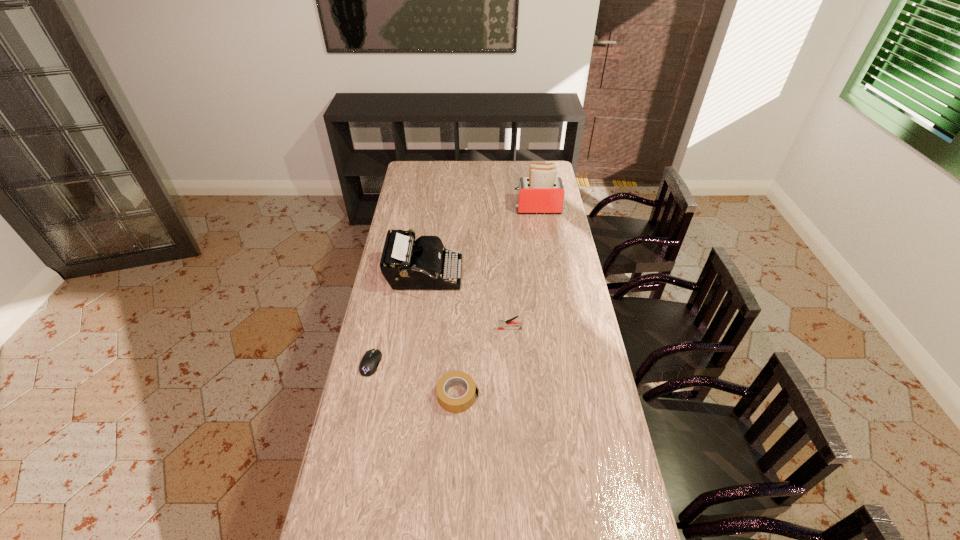
Locate an element on the screen. Image resolution: width=960 pixels, height=540 pixels. the rightmost object is located at coordinates (542, 192).

What are the coordinates of `the tallest object` in the screenshot? It's located at (542, 192).

Identify the location of the fourth nearest object. (407, 264).

In order to click on typewriter in this screenshot , I will do `click(407, 264)`.

Where is `the third tallest object`? The width and height of the screenshot is (960, 540). the third tallest object is located at coordinates (501, 326).

The image size is (960, 540). What are the coordinates of `the second object from right to left` in the screenshot? It's located at (501, 326).

Identify the location of duct tape. (456, 378).

You are a GUI agent. You are given a task and a screenshot of the screen. Output one action in this format:
    pyautogui.click(x=<x>, y=<y>)
    Task: Click on the second shortest object
    
    Given the screenshot: What is the action you would take?
    pyautogui.click(x=456, y=378)

Image resolution: width=960 pixels, height=540 pixels. Find the location of `computer equipment`. computer equipment is located at coordinates (371, 359).

The height and width of the screenshot is (540, 960). Find the location of `the shortest object`. the shortest object is located at coordinates (371, 359).